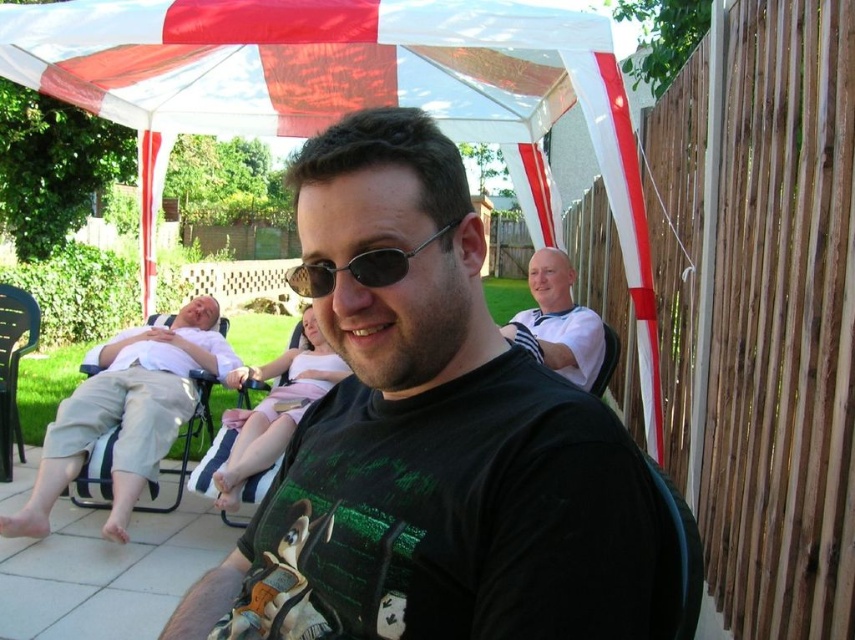
Question: Which of these objects is positioned farthest from the black plastic chair at right?

Choices:
 (A) white cotton shirt at upper right
 (B) sunglasses at center
 (C) white plastic chair at left

Answer: (B)

Question: Which object appears farthest from the camera in this image?

Choices:
 (A) sunglasses at center
 (B) black plastic chair at left

Answer: (B)

Question: Does white plastic chair at left appear over sunglasses at center?

Choices:
 (A) yes
 (B) no

Answer: (B)

Question: Is black matte t-shirt at center wider than sunglasses at center?

Choices:
 (A) no
 (B) yes

Answer: (A)

Question: Does white fabric canopy at upper center come behind black plastic chair at right?

Choices:
 (A) yes
 (B) no

Answer: (B)

Question: Among these points, which one is nearest to the camera?

Choices:
 (A) (382, 284)
 (B) (116, 13)
 (C) (78, 484)
 (D) (559, 333)

Answer: (A)